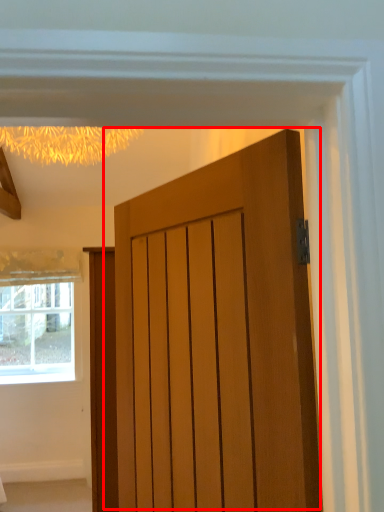
Question: From the image's perspective, what is the correct spatial positioning of door (annotated by the red box) in reference to window?

Choices:
 (A) below
 (B) above

Answer: (B)